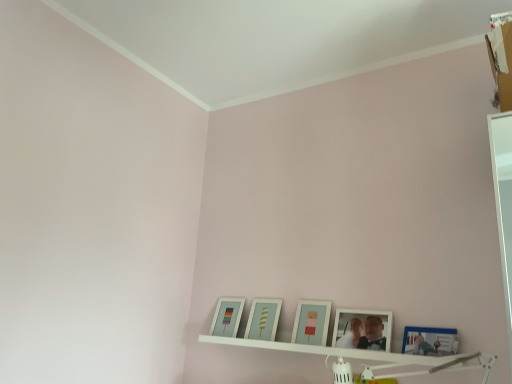
The width and height of the screenshot is (512, 384). Identify the location of blank space situated above white wooden shelf at lower center (from a real-world perspective). pos(315,347).